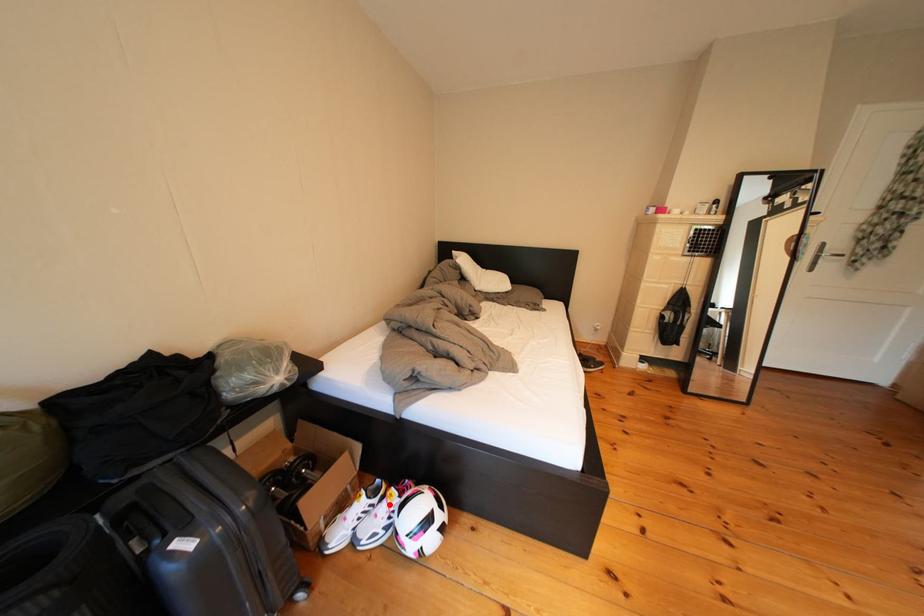
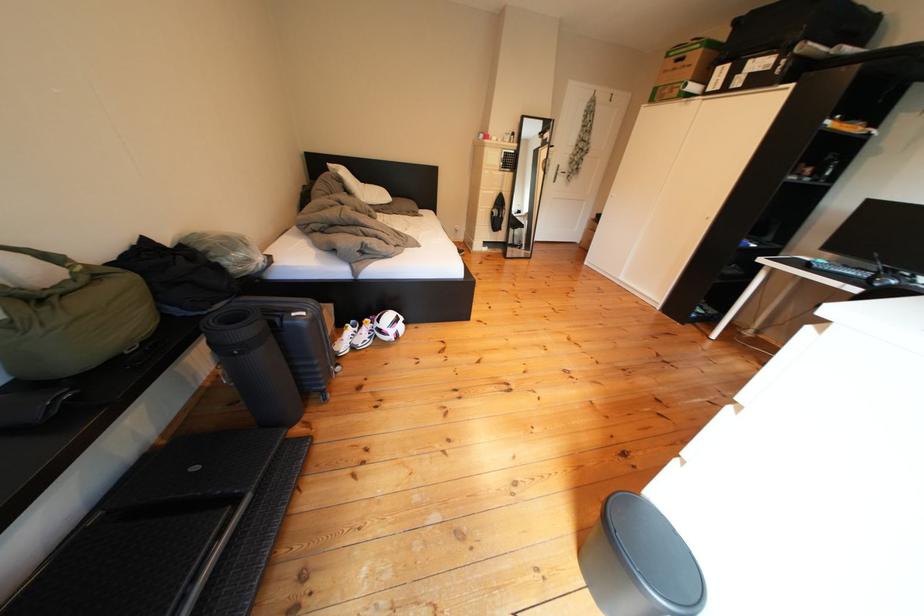
The point at the highlighted location is marked in the first image. Where is the corresponding point in the second image?

(370, 334)